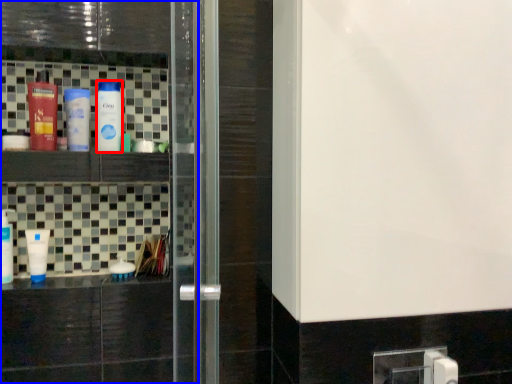
Question: Which point is closer to the camera, bottle (highlighted by a red box) or screen door (highlighted by a blue box)?

Choices:
 (A) bottle
 (B) screen door

Answer: (B)